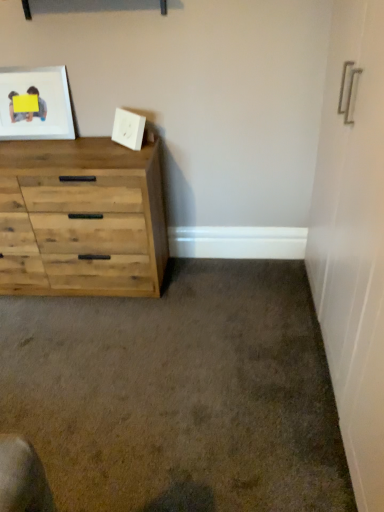
Question: Is matte wooden picture frame at upper left, marked as the 2th picture frame in a right-to-left arrangement, positioned beyond the bounds of white matte picture frame at upper center, which ranks as the 2th picture frame in left-to-right order?

Choices:
 (A) no
 (B) yes

Answer: (B)

Question: From a real-world perspective, is matte wooden picture frame at upper left, arranged as the first picture frame when viewed from the left, under white matte picture frame at upper center, which is counted as the 1th picture frame, starting from the right?

Choices:
 (A) yes
 (B) no

Answer: (B)

Question: Does matte wooden picture frame at upper left, arranged as the first picture frame when viewed from the left, have a smaller size compared to white matte picture frame at upper center, which is counted as the 1th picture frame, starting from the right?

Choices:
 (A) no
 (B) yes

Answer: (A)

Question: Considering the relative positions of matte wooden picture frame at upper left, arranged as the first picture frame when viewed from the left, and white matte picture frame at upper center, which is counted as the 1th picture frame, starting from the right, in the image provided, is matte wooden picture frame at upper left, arranged as the first picture frame when viewed from the left, to the left of white matte picture frame at upper center, which is counted as the 1th picture frame, starting from the right, from the viewer's perspective?

Choices:
 (A) no
 (B) yes

Answer: (B)

Question: Considering the relative sizes of matte wooden picture frame at upper left, arranged as the first picture frame when viewed from the left, and white matte picture frame at upper center, which ranks as the 2th picture frame in left-to-right order, in the image provided, is matte wooden picture frame at upper left, arranged as the first picture frame when viewed from the left, taller than white matte picture frame at upper center, which ranks as the 2th picture frame in left-to-right order,?

Choices:
 (A) yes
 (B) no

Answer: (A)

Question: From the image's perspective, is matte wooden picture frame at upper left, arranged as the first picture frame when viewed from the left, on top of white matte picture frame at upper center, which is counted as the 1th picture frame, starting from the right?

Choices:
 (A) yes
 (B) no

Answer: (A)

Question: Does white matte picture frame at upper center, which is counted as the 1th picture frame, starting from the right, have a greater height compared to matte wooden picture frame at upper left, arranged as the first picture frame when viewed from the left?

Choices:
 (A) yes
 (B) no

Answer: (B)

Question: Is white matte picture frame at upper center, which is counted as the 1th picture frame, starting from the right, positioned beyond the bounds of matte wooden picture frame at upper left, marked as the 2th picture frame in a right-to-left arrangement?

Choices:
 (A) yes
 (B) no

Answer: (A)

Question: Is white matte picture frame at upper center, which is counted as the 1th picture frame, starting from the right, with matte wooden picture frame at upper left, marked as the 2th picture frame in a right-to-left arrangement?

Choices:
 (A) yes
 (B) no

Answer: (B)

Question: Is white matte picture frame at upper center, which is counted as the 1th picture frame, starting from the right, shorter than matte wooden picture frame at upper left, arranged as the first picture frame when viewed from the left?

Choices:
 (A) yes
 (B) no

Answer: (A)

Question: Is white matte picture frame at upper center, which is counted as the 1th picture frame, starting from the right, to the left of matte wooden picture frame at upper left, marked as the 2th picture frame in a right-to-left arrangement, from the viewer's perspective?

Choices:
 (A) yes
 (B) no

Answer: (B)

Question: Is white matte picture frame at upper center, which ranks as the 2th picture frame in left-to-right order, oriented towards matte wooden picture frame at upper left, arranged as the first picture frame when viewed from the left?

Choices:
 (A) yes
 (B) no

Answer: (B)

Question: Does white matte picture frame at upper center, which ranks as the 2th picture frame in left-to-right order, appear on the left side of natural wood chest of drawers at left?

Choices:
 (A) no
 (B) yes

Answer: (A)